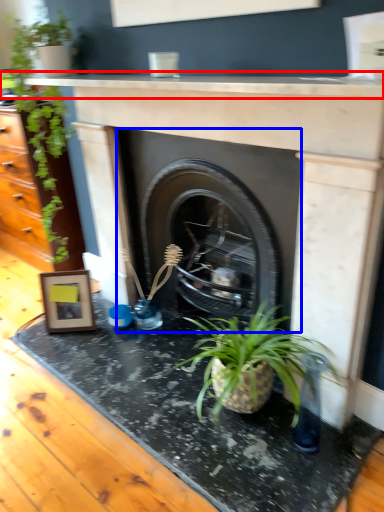
Question: Which of the following is the closest to the observer, counter top (highlighted by a red box) or fireplace (highlighted by a blue box)?

Choices:
 (A) counter top
 (B) fireplace

Answer: (A)